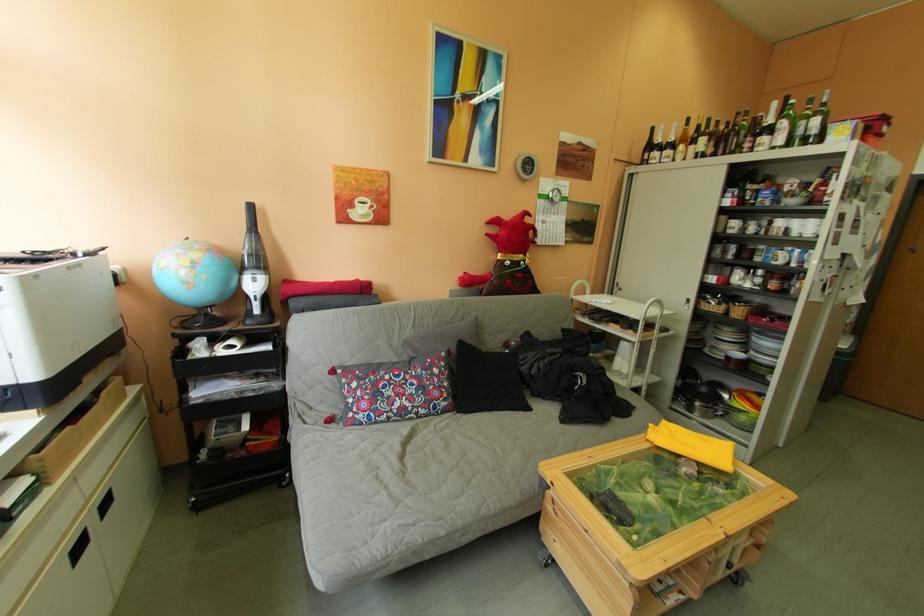
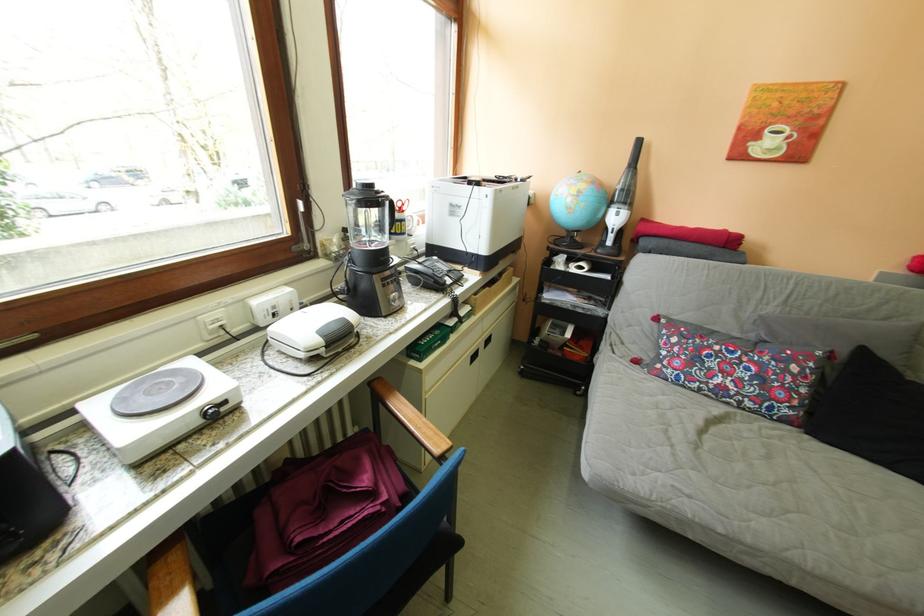
Find the pixel in the second image that matches the point at 395,405 in the first image.

(714, 373)